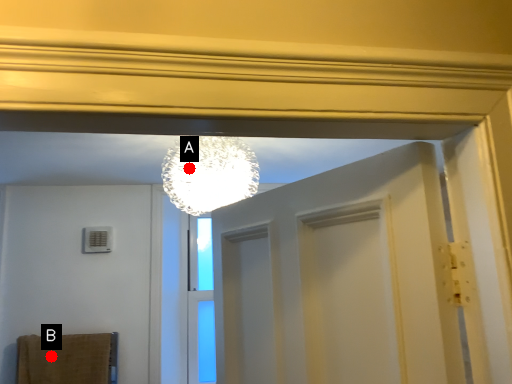
Question: Two points are circled on the image, labeled by A and B beside each circle. Which point is farther to the camera?

Choices:
 (A) A is further
 (B) B is further

Answer: (B)